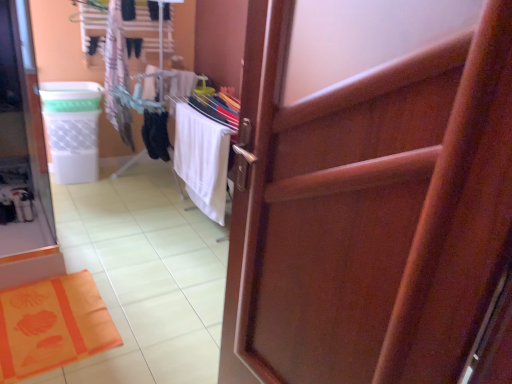
You are a GUI agent. You are given a task and a screenshot of the screen. Output one action in this format:
    pyautogui.click(x=<x>, y=<y>)
    Task: Click on the vacant area on top of orange fabric bath mat at lower left (from a real-world perspective)
    
    Given the screenshot: What is the action you would take?
    pyautogui.click(x=48, y=312)